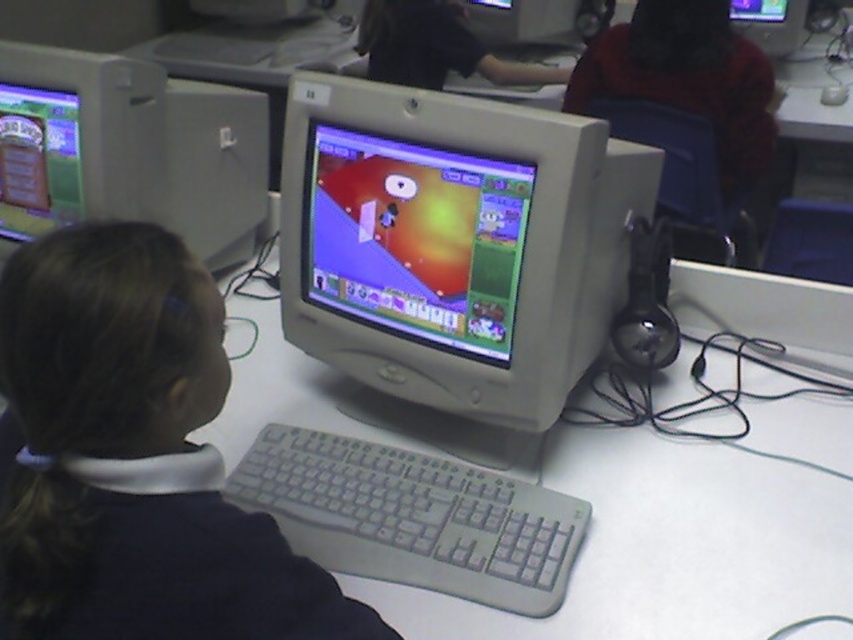
Question: Can you confirm if matte plastic monitor at center is thinner than matte gray monitor at upper center?

Choices:
 (A) no
 (B) yes

Answer: (A)

Question: Can you confirm if black matte hair at center is positioned to the left of white plastic keyboard at center?

Choices:
 (A) no
 (B) yes

Answer: (B)

Question: Estimate the real-world distances between objects in this image. Which object is farther from the matte gray monitor at upper center?

Choices:
 (A) matte gray monitor at center
 (B) white plastic keyboard at center

Answer: (B)

Question: Which object is closer to the camera taking this photo?

Choices:
 (A) black matte hair at center
 (B) white plastic keyboard at center

Answer: (A)

Question: Which object is positioned closest to the matte gray monitor at center?

Choices:
 (A) matte plastic monitor at center
 (B) matte gray monitor at upper center
 (C) white plastic keyboard at center
 (D) black matte hair at center

Answer: (A)

Question: Does matte gray monitor at center appear under white plastic keyboard at center?

Choices:
 (A) no
 (B) yes

Answer: (A)